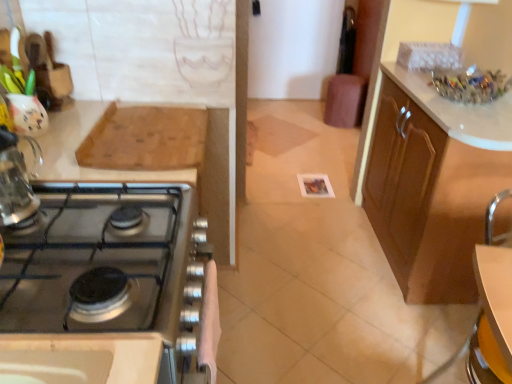
Measure the distance between point (19, 153) and camera.

Point (19, 153) and camera are 38.23 inches apart from each other.

The height and width of the screenshot is (384, 512). In order to click on wooden cutting board at upper left in this screenshot , I will do `click(82, 142)`.

Describe the element at coordinates (434, 183) in the screenshot. I see `brown wood cabinet at right, marked as the first cabinetry in a right-to-left arrangement` at that location.

Where is `brown wood cabinet at right, positioned as the 2th cabinetry in front-to-back order`? The image size is (512, 384). brown wood cabinet at right, positioned as the 2th cabinetry in front-to-back order is located at coordinates (434, 183).

What is the approximate width of brown leather bar stool at center?

It is 13.58 inches.

The image size is (512, 384). What do you see at coordinates (496, 292) in the screenshot? I see `white glossy table at lower right` at bounding box center [496, 292].

This screenshot has height=384, width=512. Identify the location of clear glass kettle at left. (14, 183).

Is white glossy table at lower right taller or shorter than satin silver stove at left, the second cabinetry positioned from the right?

In the image, white glossy table at lower right appears to be shorter than satin silver stove at left, the second cabinetry positioned from the right.

Does white glossy table at lower right come behind satin silver stove at left, the first cabinetry when ordered from front to back?

Yes, white glossy table at lower right is behind satin silver stove at left, the first cabinetry when ordered from front to back.

Can you tell me how much white glossy table at lower right and satin silver stove at left, the second cabinetry positioned from the right, differ in facing direction?

They differ by 169 degrees in their facing directions.

Considering the relative sizes of white glossy table at lower right and satin silver stove at left, the first cabinetry positioned from the left, in the image provided, is white glossy table at lower right smaller than satin silver stove at left, the first cabinetry positioned from the left,?

Yes, white glossy table at lower right is smaller than satin silver stove at left, the first cabinetry positioned from the left.

Image resolution: width=512 pixels, height=384 pixels. I want to click on table above the brown wood cabinet at right, which ranks as the first cabinetry in back-to-front order (from a real-world perspective), so click(496, 292).

Is white glossy table at lower right next to brown wood cabinet at right, which ranks as the first cabinetry in back-to-front order?

No, white glossy table at lower right is not with brown wood cabinet at right, which ranks as the first cabinetry in back-to-front order.

From a real-world perspective, which is physically below, white glossy table at lower right or brown wood cabinet at right, positioned as the 2th cabinetry in front-to-back order?

brown wood cabinet at right, positioned as the 2th cabinetry in front-to-back order, is physically lower.

Which is more to the left, white glossy table at lower right or brown wood cabinet at right, positioned as the 2th cabinetry in front-to-back order?

white glossy table at lower right.

Based on the photo, is white glossy table at lower right located within wooden cutting board at upper left?

No, white glossy table at lower right is located outside of wooden cutting board at upper left.

Which of these two, wooden cutting board at upper left or white glossy table at lower right, stands taller?

wooden cutting board at upper left is taller.

From the picture: From the image's perspective, relative to white glossy table at lower right, is wooden cutting board at upper left above or below?

Based on their image positions, wooden cutting board at upper left is located above white glossy table at lower right.

Is white glossy table at lower right at the back of wooden cutting board at upper left?

wooden cutting board at upper left does not have its back to white glossy table at lower right.

Is satin silver stove at left, which is counted as the 2th cabinetry, starting from the back, a part of wooden cutting board at upper left?

No.

Which of these two, wooden cutting board at upper left or satin silver stove at left, the first cabinetry when ordered from front to back, stands shorter?

With less height is wooden cutting board at upper left.

Is point (89, 171) behind point (152, 265)?

That is True.

Between wooden cutting board at upper left and clear glass kettle at left, which one is positioned in front?

clear glass kettle at left is in front.

Is wooden cutting board at upper left at the right side of clear glass kettle at left?

Yes.

From the picture: From the image's perspective, who appears lower, wooden cutting board at upper left or clear glass kettle at left?

From the image's view, clear glass kettle at left is below.

Is point (57, 178) positioned in front of point (13, 204)?

No.

Which is behind, satin silver stove at left, the first cabinetry positioned from the left, or brown leather bar stool at center?

Positioned behind is brown leather bar stool at center.

Which is more to the left, satin silver stove at left, the first cabinetry when ordered from front to back, or brown leather bar stool at center?

From the viewer's perspective, satin silver stove at left, the first cabinetry when ordered from front to back, appears more on the left side.

Is satin silver stove at left, the first cabinetry when ordered from front to back, thinner than brown leather bar stool at center?

No, satin silver stove at left, the first cabinetry when ordered from front to back, is not thinner than brown leather bar stool at center.

Considering the relative sizes of satin silver stove at left, the first cabinetry positioned from the left, and brown leather bar stool at center in the image provided, is satin silver stove at left, the first cabinetry positioned from the left, smaller than brown leather bar stool at center?

Indeed, satin silver stove at left, the first cabinetry positioned from the left, has a smaller size compared to brown leather bar stool at center.

Who is smaller, brown wood cabinet at right, which ranks as the first cabinetry in back-to-front order, or clear glass kettle at left?

clear glass kettle at left is smaller.

From a real-world perspective, is brown wood cabinet at right, the second cabinetry when ordered from left to right, physically located above or below clear glass kettle at left?

From a real-world perspective, brown wood cabinet at right, the second cabinetry when ordered from left to right, is physically below clear glass kettle at left.

Considering the positions of objects brown wood cabinet at right, positioned as the 2th cabinetry in front-to-back order, and clear glass kettle at left in the image provided, who is in front, brown wood cabinet at right, positioned as the 2th cabinetry in front-to-back order, or clear glass kettle at left?

clear glass kettle at left is more forward.

Between point (459, 195) and point (35, 200), which one is positioned behind?

The point (459, 195) is farther from the camera.

The width and height of the screenshot is (512, 384). I want to click on cabinetry lying on the left of white glossy table at lower right, so click(102, 269).

The width and height of the screenshot is (512, 384). In order to click on table below the brown wood cabinet at right, marked as the first cabinetry in a right-to-left arrangement (from the image's perspective) in this screenshot , I will do point(496,292).

Considering their positions, is wooden cutting board at upper left positioned further to clear glass kettle at left than brown leather bar stool at center?

brown leather bar stool at center lies further to clear glass kettle at left than the other object.

When comparing their distances from satin silver stove at left, the first cabinetry when ordered from front to back, does white glossy table at lower right or brown wood cabinet at right, the second cabinetry when ordered from left to right, seem further?

brown wood cabinet at right, the second cabinetry when ordered from left to right, lies further to satin silver stove at left, the first cabinetry when ordered from front to back, than the other object.

When comparing their distances from brown wood cabinet at right, which ranks as the first cabinetry in back-to-front order, does satin silver stove at left, the first cabinetry when ordered from front to back, or wooden cutting board at upper left seem further?

The object further to brown wood cabinet at right, which ranks as the first cabinetry in back-to-front order, is satin silver stove at left, the first cabinetry when ordered from front to back.

From the image, which object appears to be nearer to satin silver stove at left, the first cabinetry positioned from the left, clear glass kettle at left or white glossy table at lower right?

clear glass kettle at left lies closer to satin silver stove at left, the first cabinetry positioned from the left, than the other object.

Which object lies nearer to the anchor point brown leather bar stool at center, brown wood cabinet at right, the second cabinetry when ordered from left to right, or satin silver stove at left, the first cabinetry positioned from the left?

brown wood cabinet at right, the second cabinetry when ordered from left to right.

Based on their spatial positions, is brown leather bar stool at center or white glossy table at lower right further from clear glass kettle at left?

brown leather bar stool at center lies further to clear glass kettle at left than the other object.

When comparing their distances from satin silver stove at left, the first cabinetry when ordered from front to back, does clear glass kettle at left or wooden cutting board at upper left seem further?

clear glass kettle at left is further to satin silver stove at left, the first cabinetry when ordered from front to back.

Considering their positions, is clear glass kettle at left positioned further to white glossy table at lower right than satin silver stove at left, the second cabinetry positioned from the right?

clear glass kettle at left is further to white glossy table at lower right.

I want to click on countertop between satin silver stove at left, the first cabinetry positioned from the left, and brown leather bar stool at center from front to back, so click(x=82, y=142).

Identify the location of table between satin silver stove at left, the first cabinetry positioned from the left, and brown leather bar stool at center from front to back. (496, 292).

Find the location of a particular element. Image resolution: width=512 pixels, height=384 pixels. cabinetry positioned between satin silver stove at left, the second cabinetry positioned from the right, and brown leather bar stool at center from near to far is located at coordinates (434, 183).

Identify the location of countertop situated between clear glass kettle at left and brown wood cabinet at right, marked as the first cabinetry in a right-to-left arrangement, from left to right. The height and width of the screenshot is (384, 512). (82, 142).